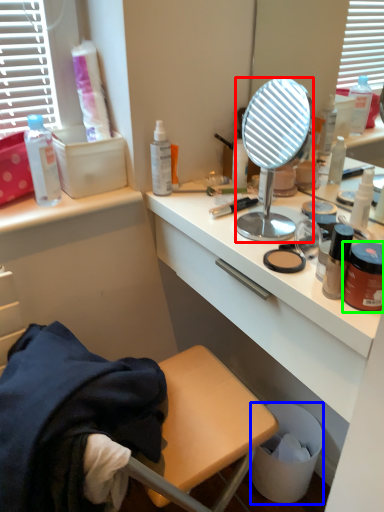
Question: Considering the real-world distances, which object is farthest from mirror (highlighted by a red box)? trash bin/can (highlighted by a blue box) or cosmetic (highlighted by a green box)?

Choices:
 (A) trash bin/can
 (B) cosmetic

Answer: (A)